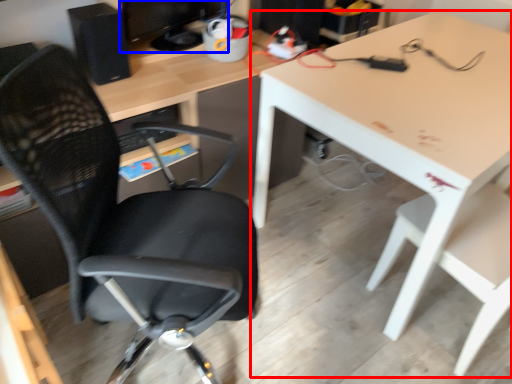
Question: Which of the following is the farthest to the observer, table (highlighted by a red box) or computer monitor (highlighted by a blue box)?

Choices:
 (A) table
 (B) computer monitor

Answer: (B)